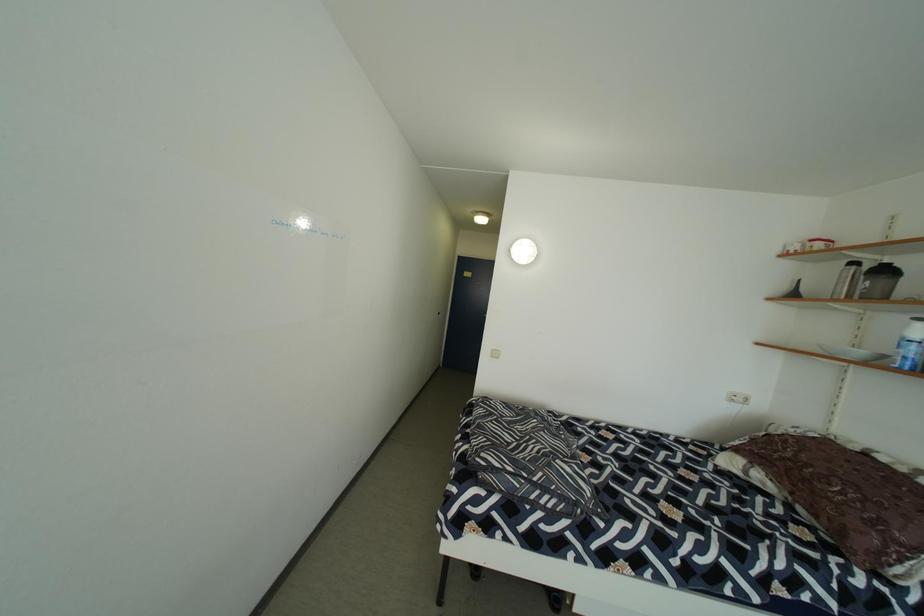
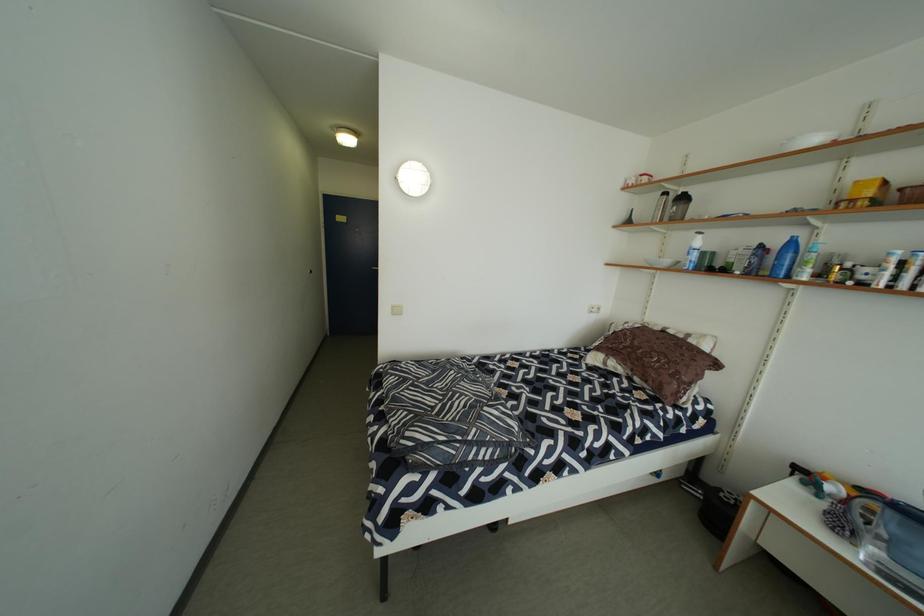
Question: Based on the continuous images, in which direction is the camera rotating? Reply with the corresponding letter.

Choices:
 (A) Left
 (B) Right
 (C) Up
 (D) Down

Answer: (B)